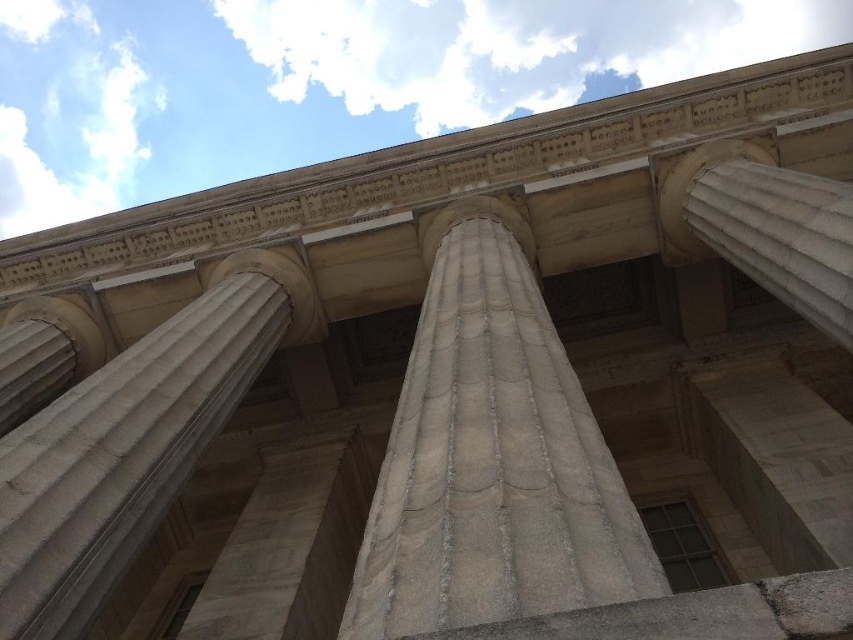
You are a maintenance worker needing to inspect the white stone column at center. Your ladder can reach up to 6 meters. Can you safely reach the top of the column with your ladder?

The distance between you and the white stone column at center is 6.23 meters. Since your ladder can only reach up to 6 meters, you cannot safely reach the top of the column with your ladder.

You are an architect examining the classical structure. You notice two columns, the white marble column at center and the white marble column at upper right. Which column is bigger in size?

The white marble column at center is larger in size compared to the white marble column at upper right.